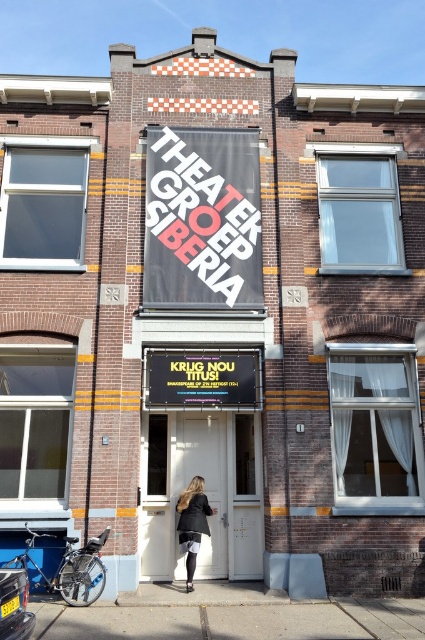
You are standing in front of the building and want to locate the black matte signboard at center. According to the coordinates provided, where should you look to find it?

The black matte signboard at center is located at point 0.717 on the x axis and 0.478 on the y axis.